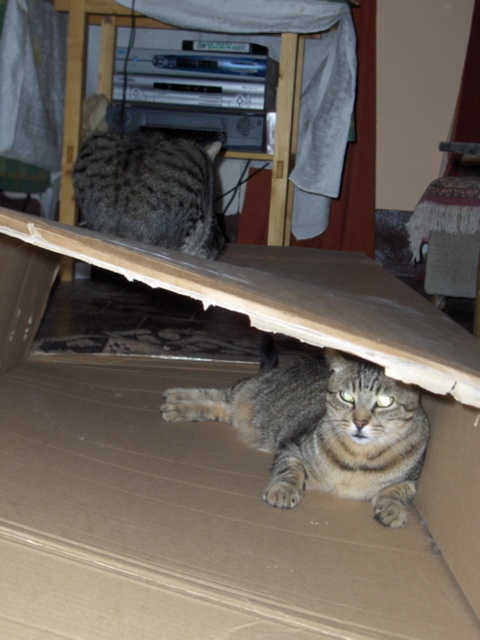
Question: Is brown cardboard box at lower center to the right of tabby fur cat at lower center from the viewer's perspective?

Choices:
 (A) yes
 (B) no

Answer: (B)

Question: Does tabby fur cat at lower center appear on the right side of gray striped cat at center?

Choices:
 (A) yes
 (B) no

Answer: (A)

Question: Among these points, which one is farthest from the camera?

Choices:
 (A) pyautogui.click(x=192, y=180)
 (B) pyautogui.click(x=472, y=509)
 (C) pyautogui.click(x=356, y=480)

Answer: (A)

Question: Which object is positioned closest to the gray striped cat at center?

Choices:
 (A) brown cardboard box at lower center
 (B) tabby fur cat at lower center

Answer: (A)

Question: Which object is closer to the camera taking this photo?

Choices:
 (A) brown cardboard box at lower center
 (B) gray striped cat at center
 (C) tabby fur cat at lower center

Answer: (A)

Question: Can you confirm if brown cardboard box at lower center is bigger than gray striped cat at center?

Choices:
 (A) no
 (B) yes

Answer: (B)